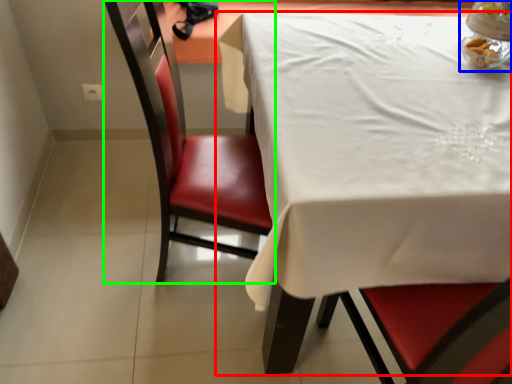
Question: Which object is the closest to the table (highlighted by a red box)? Choose among these: tableware (highlighted by a blue box) or chair (highlighted by a green box).

Choices:
 (A) tableware
 (B) chair

Answer: (B)